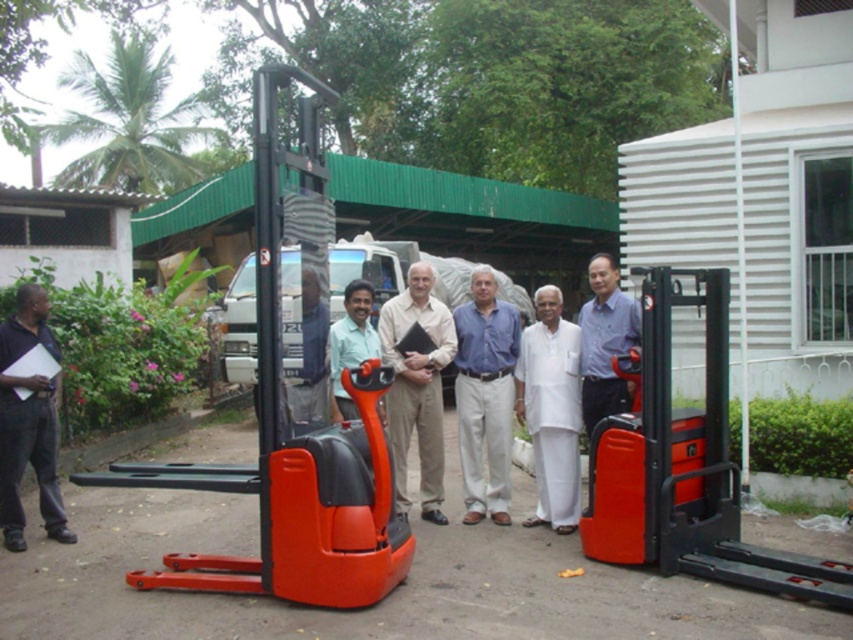
Question: Among these objects, which one is farthest from the camera?

Choices:
 (A) white cotton kurta at center
 (B) blue cotton shirt at center
 (C) beige cotton pants at center
 (D) blue shirt at center

Answer: (B)

Question: Does white cotton kurta at center come in front of blue shirt at center?

Choices:
 (A) no
 (B) yes

Answer: (A)

Question: Which object appears farthest from the camera in this image?

Choices:
 (A) white cotton kurta at center
 (B) blue cotton shirt at center

Answer: (B)

Question: Does orange plastic forklift at center have a larger size compared to light green fabric shirt at center?

Choices:
 (A) yes
 (B) no

Answer: (A)

Question: Which point is closer to the camera taking this photo?

Choices:
 (A) (396, 403)
 (B) (306, 545)
 (C) (569, 333)
 (D) (467, 387)

Answer: (B)

Question: Is white cotton kurta at center smaller than blue shirt at center?

Choices:
 (A) yes
 (B) no

Answer: (A)